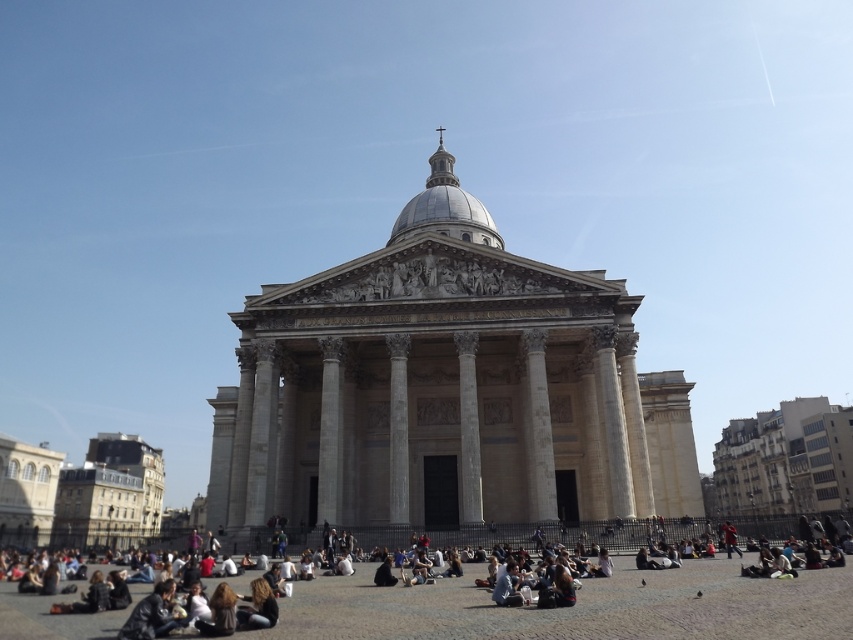
How distant is dark gray stone people at lower center from blonde hair at lower left?

dark gray stone people at lower center is 14.57 meters away from blonde hair at lower left.

Who is positioned more to the right, dark gray stone people at lower center or blonde hair at lower left?

Positioned to the right is dark gray stone people at lower center.

Image resolution: width=853 pixels, height=640 pixels. What do you see at coordinates (578, 605) in the screenshot? I see `dark gray stone people at lower center` at bounding box center [578, 605].

Identify the location of dark gray stone people at lower center. (578, 605).

Does blonde hair at lower left lie behind dark brown hair at lower center?

Yes, blonde hair at lower left is behind dark brown hair at lower center.

Does blonde hair at lower left appear on the right side of dark brown hair at lower center?

Yes, blonde hair at lower left is to the right of dark brown hair at lower center.

Where is `blonde hair at lower left`? The height and width of the screenshot is (640, 853). blonde hair at lower left is located at coordinates (258, 608).

Is dark gray stone people at lower center shorter than dark brown hair at lower center?

No.

Who is lower down, dark gray stone people at lower center or dark brown hair at lower center?

dark gray stone people at lower center

Find the location of a particular element. dark gray stone people at lower center is located at coordinates (578, 605).